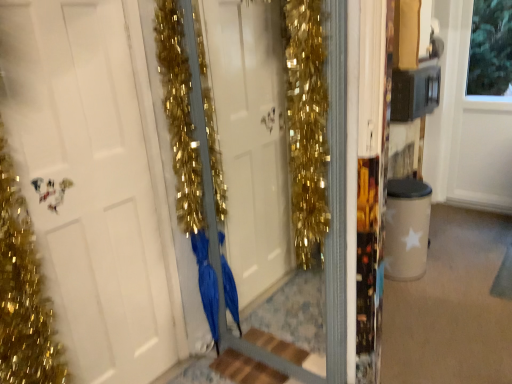
Question: Is white matte door at center far from wooden at center?

Choices:
 (A) no
 (B) yes

Answer: (A)

Question: Can you confirm if white matte door at center is taller than wooden at center?

Choices:
 (A) no
 (B) yes

Answer: (B)

Question: Considering the relative sizes of white matte door at center and wooden at center in the image provided, is white matte door at center shorter than wooden at center?

Choices:
 (A) yes
 (B) no

Answer: (B)

Question: Is white matte door at center in contact with wooden at center?

Choices:
 (A) yes
 (B) no

Answer: (B)

Question: Is white matte door at center positioned behind wooden at center?

Choices:
 (A) yes
 (B) no

Answer: (B)

Question: From their relative heights in the image, would you say wooden at center is taller or shorter than white matte door at center?

Choices:
 (A) tall
 (B) short

Answer: (B)

Question: Is wooden at center in front of or behind white matte door at center in the image?

Choices:
 (A) front
 (B) behind

Answer: (B)

Question: Looking at their shapes, would you say wooden at center is wider or thinner than white matte door at center?

Choices:
 (A) thin
 (B) wide

Answer: (B)

Question: From the image's perspective, is wooden at center located above or below white matte door at center?

Choices:
 (A) above
 (B) below

Answer: (B)

Question: Is point (237, 322) positioned closer to the camera than point (141, 185)?

Choices:
 (A) closer
 (B) farther

Answer: (B)

Question: Considering the relative positions of blue satin dress at center and white matte door at center in the image provided, is blue satin dress at center to the left or to the right of white matte door at center?

Choices:
 (A) right
 (B) left

Answer: (A)

Question: Considering the positions of blue satin dress at center and white matte door at center in the image, is blue satin dress at center bigger or smaller than white matte door at center?

Choices:
 (A) small
 (B) big

Answer: (A)

Question: In terms of width, does blue satin dress at center look wider or thinner when compared to white matte door at center?

Choices:
 (A) wide
 (B) thin

Answer: (A)

Question: Looking at the image, does wooden at center seem bigger or smaller compared to blue satin dress at center?

Choices:
 (A) big
 (B) small

Answer: (B)

Question: From a real-world perspective, is wooden at center above or below blue satin dress at center?

Choices:
 (A) above
 (B) below

Answer: (B)